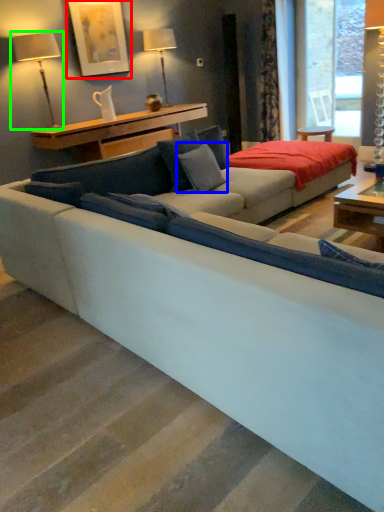
Question: Which is farther away from picture frame (highlighted by a red box)? pillow (highlighted by a blue box) or table lamp (highlighted by a green box)?

Choices:
 (A) pillow
 (B) table lamp

Answer: (A)